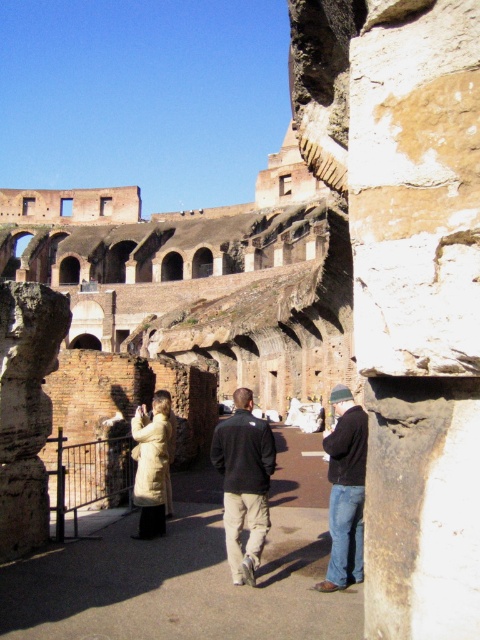
Question: Where is weathered stone column at center located in relation to beige wool coat at center in the image?

Choices:
 (A) left
 (B) right

Answer: (B)

Question: Which point is farther to the camera?

Choices:
 (A) dark blue jeans at center
 (B) beige wool coat at center

Answer: (B)

Question: Which of the following is the closest to the observer?

Choices:
 (A) dark blue jeans at center
 (B) weathered stone column at center
 (C) dark gray fleece jacket at center

Answer: (B)

Question: Is dark gray fleece jacket at center smaller than dark blue jeans at center?

Choices:
 (A) yes
 (B) no

Answer: (A)

Question: Estimate the real-world distances between objects in this image. Which object is closer to the dark blue jeans at center?

Choices:
 (A) weathered stone column at center
 (B) dark gray fleece jacket at center

Answer: (B)

Question: Does dark blue jeans at center appear on the right side of beige wool coat at center?

Choices:
 (A) no
 (B) yes

Answer: (B)